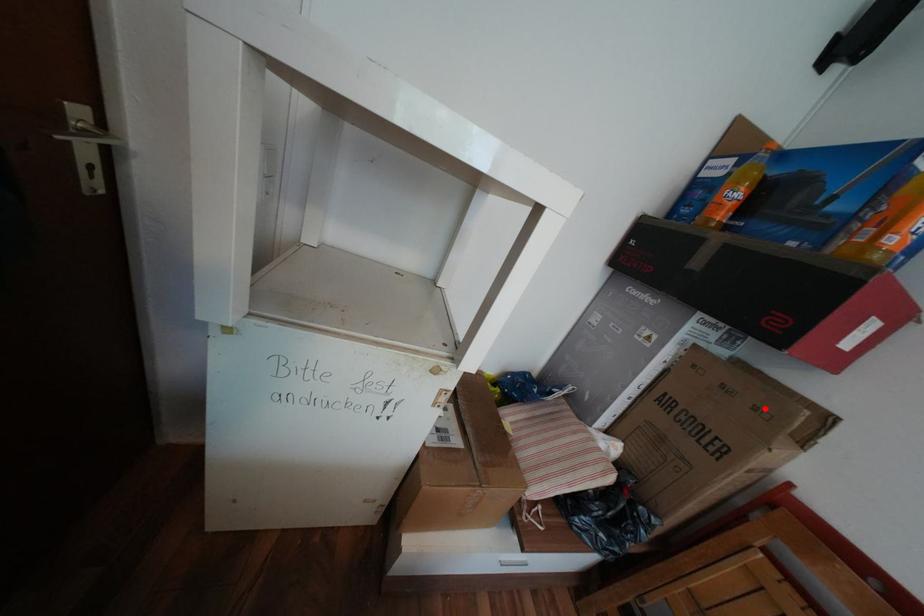
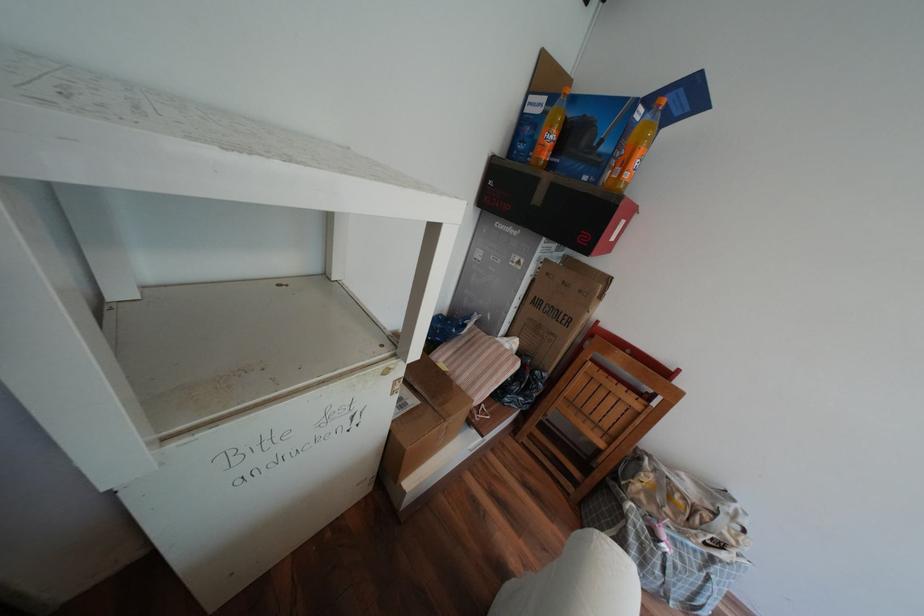
Where in the second image is the point corresponding to the highlighted location from the first image?

(590, 291)